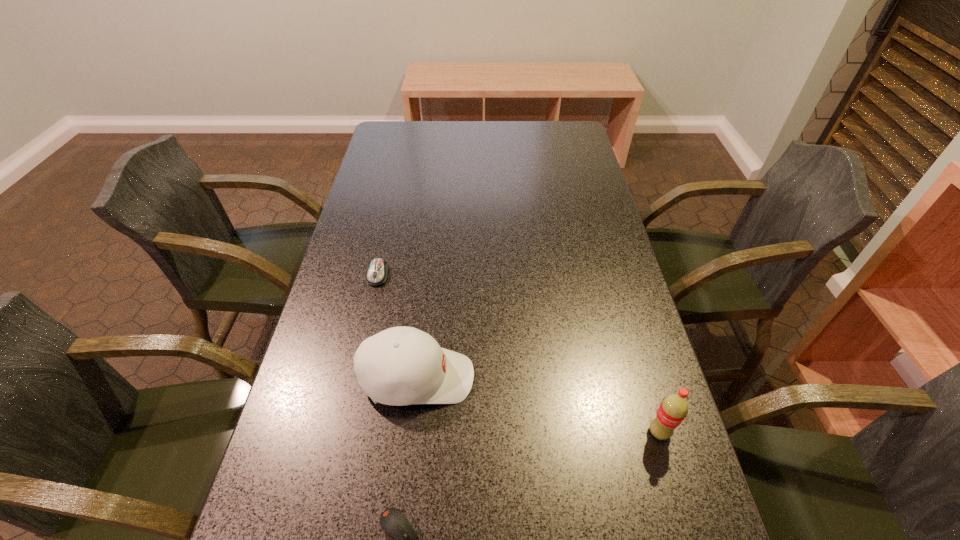
The height and width of the screenshot is (540, 960). What are the coordinates of `vacant point located between the second tallest object and the rightmost object` in the screenshot? It's located at (538, 405).

Identify the location of free point between the third shortest object and the rightmost object. The height and width of the screenshot is (540, 960). (538, 405).

Where is `object that can be found as the closest to the second shortest object`? Image resolution: width=960 pixels, height=540 pixels. object that can be found as the closest to the second shortest object is located at coordinates (399, 366).

Identify the location of object that ranks as the second closest to the third nearest object. This screenshot has width=960, height=540. (377, 273).

I want to click on free point that satisfies the following two spatial constraints: 1. on the front-facing side of the tallest object; 2. on the right side of the baseball cap, so click(411, 432).

Locate an element on the screen. The height and width of the screenshot is (540, 960). free location that satisfies the following two spatial constraints: 1. on the wheel side of the soda; 2. on the right side of the left computer mouse is located at coordinates (343, 432).

You are a GUI agent. You are given a task and a screenshot of the screen. Output one action in this format:
    pyautogui.click(x=<x>, y=<y>)
    Task: Click on the vacant space that satisfies the following two spatial constraints: 1. on the back side of the third farthest object; 2. on the front-facing side of the baseball cap
    
    Given the screenshot: What is the action you would take?
    tap(643, 378)

Where is `free spot that satisfies the following two spatial constraints: 1. on the wheel side of the farther computer mouse; 2. on the left side of the third farthest object`? free spot that satisfies the following two spatial constraints: 1. on the wheel side of the farther computer mouse; 2. on the left side of the third farthest object is located at coordinates (343, 432).